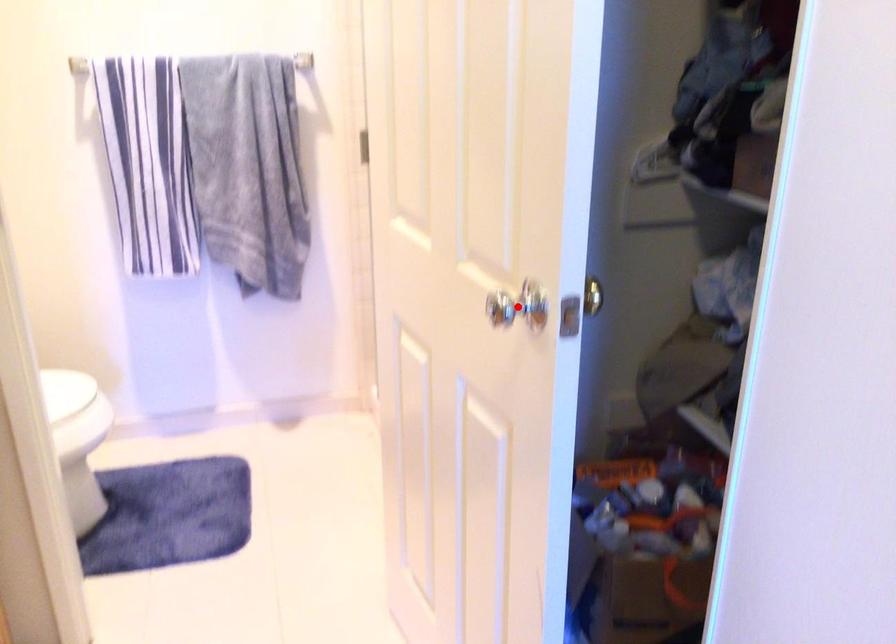
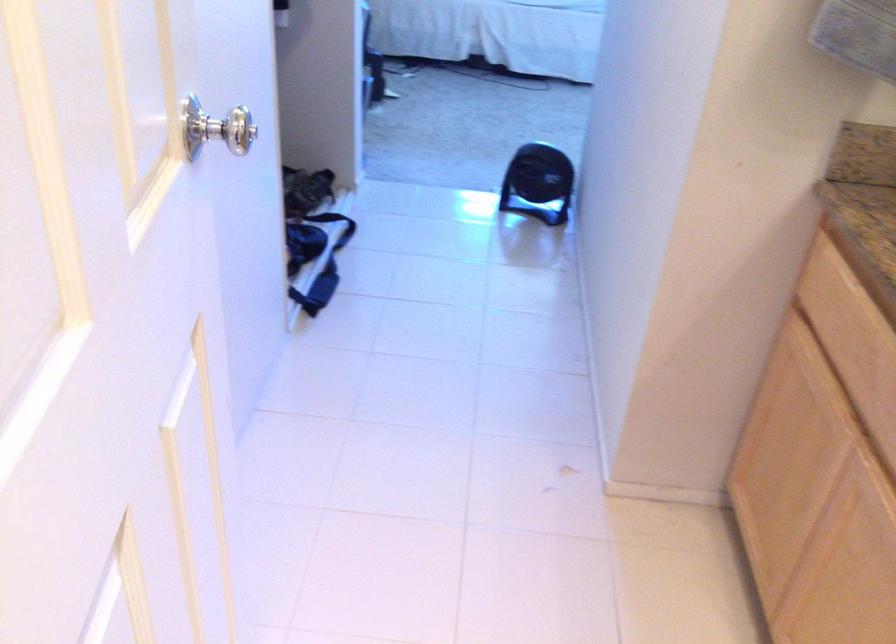
Question: I am providing you with two images of the same scene from different viewpoints. A red point is marked on the first image. Can you still see the location of the red point in image 2?

Choices:
 (A) Yes
 (B) No

Answer: (B)